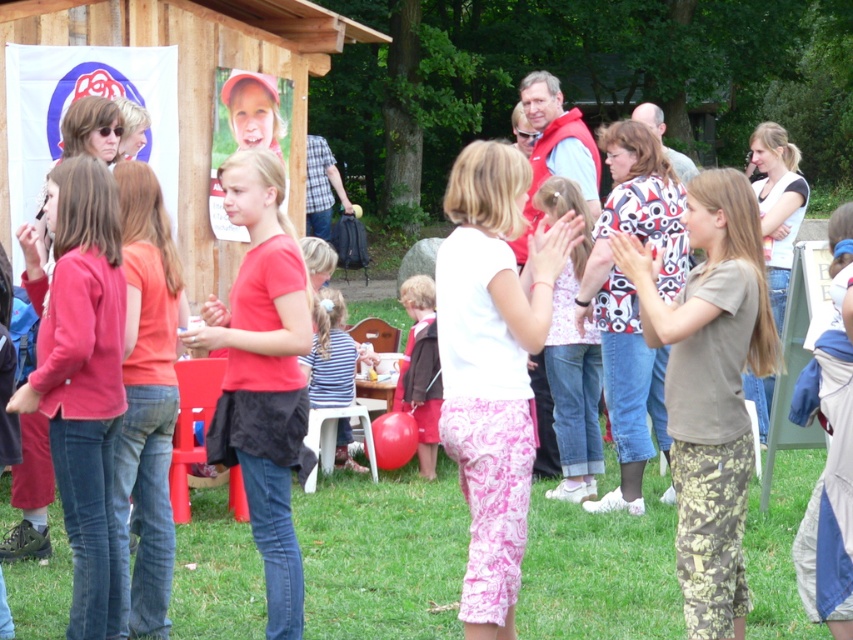
You are organizing a photo shoot and need to arrange two red garments in a row for a fashion display. The matte red jacket at left and the matte red shirt at center are available. Based on their sizes, which should be placed first if you want the wider item to be on the left side of the display?

The matte red jacket at left should be placed first on the left side of the display since it might be wider than the matte red shirt at center.

You are organizing a group photo and want to arrange the white cotton shirt at center and the matte red jacket at left side by side. Which clothing item requires more horizontal space?

The matte red jacket at left requires more horizontal space because it has a greater width than the white cotton shirt at center.

In the scene shown: You are at the community event and want to find the matte red jacket at left and the matte red shirt at center. Which one would you see first as you look from left to right across the scene?

You would see the matte red jacket at left first as you look from left to right because it is positioned to the left of the matte red shirt at center.